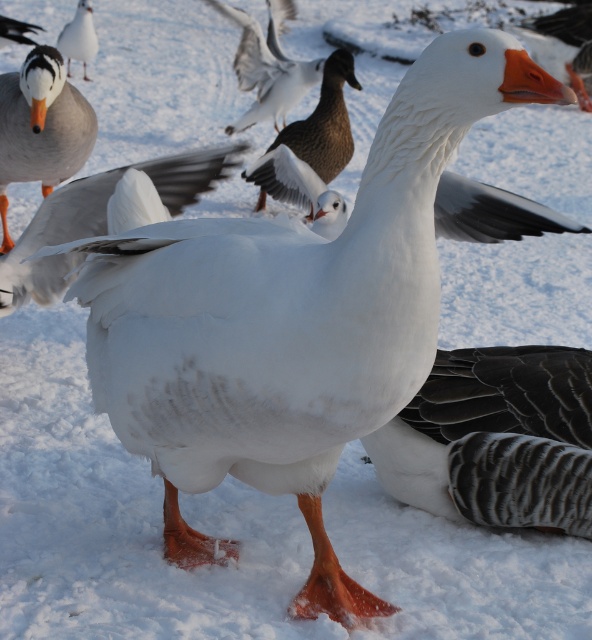
In the scene shown: Is white feathered duck at left below orange beak at center?

Indeed, white feathered duck at left is positioned under orange beak at center.

In order to click on white feathered duck at left in this screenshot , I will do `click(40, 125)`.

Find the location of a particular element. white feathered duck at left is located at coordinates (40, 125).

Is point (350, 154) behind point (540, 28)?

No.

Is brown matte duck at center to the right of orange beak at center from the viewer's perspective?

No, brown matte duck at center is not to the right of orange beak at center.

Which is behind, point (337, 90) or point (549, 36)?

The point (549, 36) is more distant.

At what (x,y) coordinates should I click in order to perform the action: click on brown matte duck at center. Please return your answer as a coordinate pair (x, y). Looking at the image, I should click on (326, 122).

Does brown matte duck at center come behind white matte goose at upper left?

That is False.

Can you confirm if brown matte duck at center is wider than white matte goose at upper left?

No, brown matte duck at center is not wider than white matte goose at upper left.

The height and width of the screenshot is (640, 592). What do you see at coordinates (326, 122) in the screenshot?
I see `brown matte duck at center` at bounding box center [326, 122].

The width and height of the screenshot is (592, 640). What are the coordinates of `brown matte duck at center` in the screenshot? It's located at (326, 122).